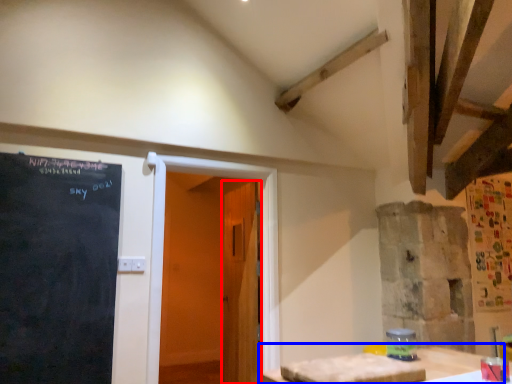
Question: Which point is closer to the camera, door (highlighted by a red box) or table (highlighted by a blue box)?

Choices:
 (A) door
 (B) table

Answer: (B)